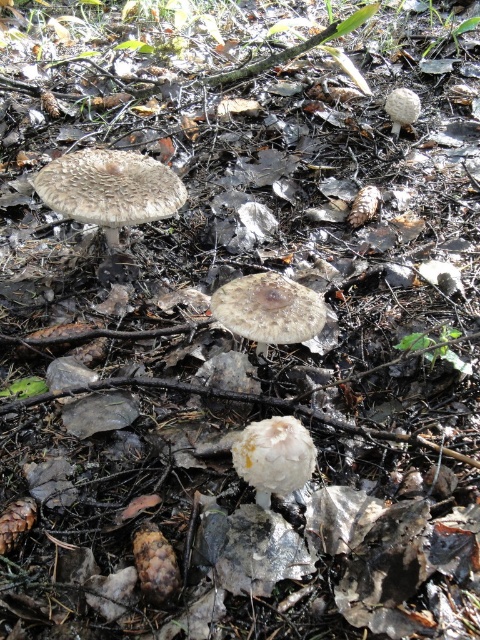
You are a mycologist studying mushrooms in the forest. You observe the brown textured mushroom at center and the white fuzzy mushroom at upper right. Which mushroom is taller?

The brown textured mushroom at center is taller than the white fuzzy mushroom at upper right according to the description.

You are a photographer standing at the edge of the forest. You want to take a closeup photo of the brown textured mushroom at center. Considering your current position, do you need to move closer or farther away to get a better closeup?

The brown textured mushroom at center is 1.35 meters from the camera. To take a closeup, you need to move closer to reduce the distance between the camera and the mushroom.